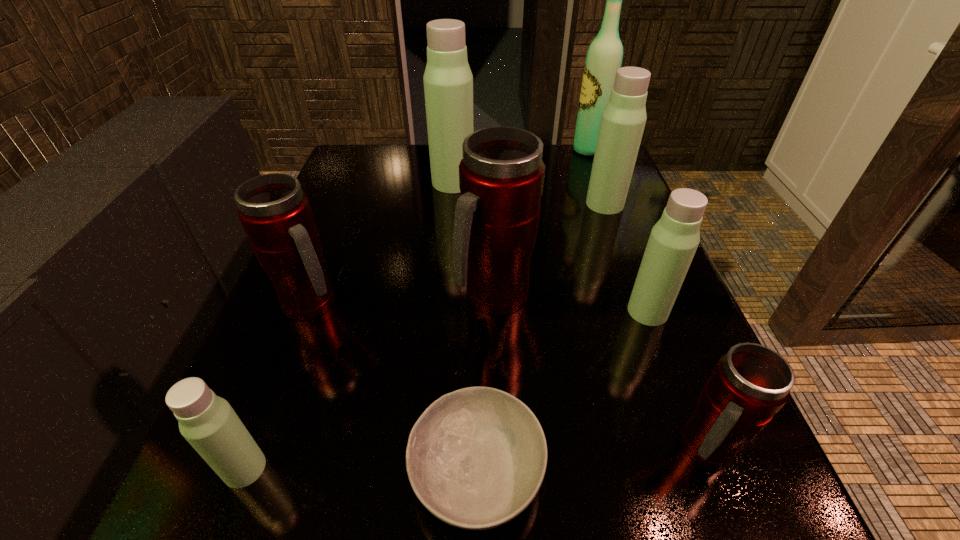
The height and width of the screenshot is (540, 960). In order to click on blank space located on the back of the second smallest light thermos bottle in this screenshot , I will do `click(610, 211)`.

Find the location of `blank area located 0.180m on the right of the smallest light thermos bottle`. blank area located 0.180m on the right of the smallest light thermos bottle is located at coordinates (401, 468).

Identify the location of wine bottle situated at the far edge. (604, 57).

The image size is (960, 540). In order to click on thermos bottle present at the far edge in this screenshot , I will do `click(448, 81)`.

Locate an element on the screen. The height and width of the screenshot is (540, 960). wine bottle at the right edge is located at coordinates (604, 57).

At what (x,y) coordinates should I click in order to perform the action: click on object that is at the near left corner. Please return your answer as a coordinate pair (x, y). Looking at the image, I should click on (208, 422).

Identify the location of object that is positioned at the far right corner. (604, 57).

Find the location of a particular element. The height and width of the screenshot is (540, 960). object positioned at the near right corner is located at coordinates (751, 383).

In the image, there is a desktop. Identify the location of vacant space at the far edge. The width and height of the screenshot is (960, 540). (561, 175).

In the image, there is a desktop. At what (x,y) coordinates should I click in order to perform the action: click on vacant space at the near edge. Please return your answer as a coordinate pair (x, y). The width and height of the screenshot is (960, 540). Looking at the image, I should click on (610, 538).